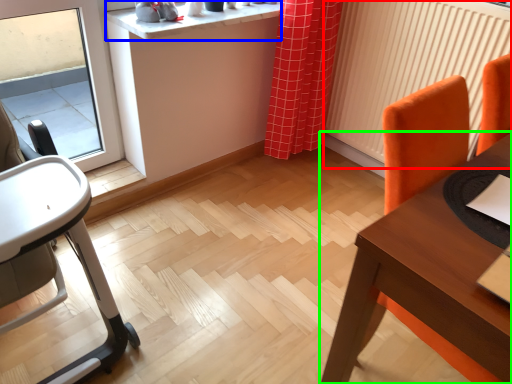
Question: Which object is the farthest from radiator (highlighted by a red box)? Choose among these: counter top (highlighted by a blue box) or table (highlighted by a green box).

Choices:
 (A) counter top
 (B) table

Answer: (B)